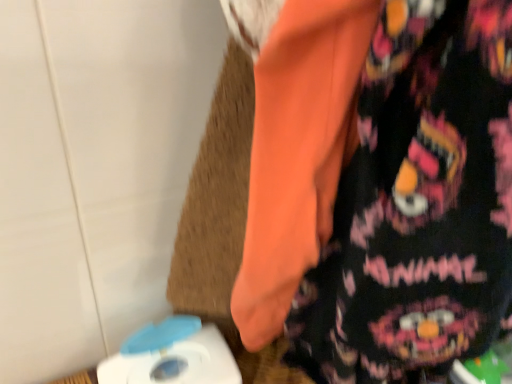
Question: Should I look upward or downward to see white plastic toy at lower left?

Choices:
 (A) up
 (B) down

Answer: (B)